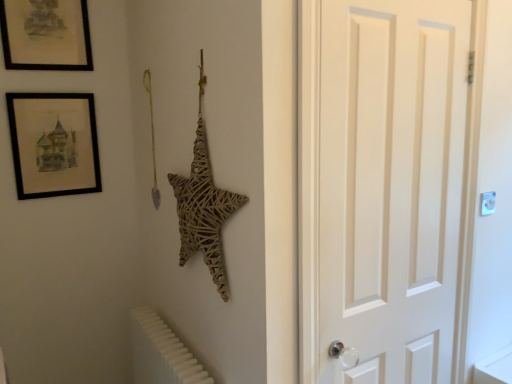
Describe the element at coordinates (488, 203) in the screenshot. I see `white plastic light switch at upper right` at that location.

The image size is (512, 384). I want to click on white plastic radiator at lower left, so click(161, 352).

What is the approximate width of black matte picture frame at upper left, positioned as the 1th picture frame in bottom-to-top order?

The width of black matte picture frame at upper left, positioned as the 1th picture frame in bottom-to-top order, is 2.23 inches.

Locate an element on the screen. white wooden door at right is located at coordinates (385, 187).

You are a GUI agent. You are given a task and a screenshot of the screen. Output one action in this format:
    pyautogui.click(x=<x>, y=<y>)
    Task: Click on the white plastic light switch at upper right
    
    Given the screenshot: What is the action you would take?
    pyautogui.click(x=488, y=203)

Image resolution: width=512 pixels, height=384 pixels. Identify the location of radiator that appears below the white wooden door at right (from a real-world perspective). (161, 352).

Can you confirm if white plastic radiator at lower left is thinner than white wooden door at right?

No, white plastic radiator at lower left is not thinner than white wooden door at right.

Looking at this image, considering the positions of objects white plastic radiator at lower left and white wooden door at right in the image provided, who is more to the right, white plastic radiator at lower left or white wooden door at right?

white wooden door at right.

From the picture: Is white plastic radiator at lower left facing away from white wooden door at right?

No, white plastic radiator at lower left's orientation is not away from white wooden door at right.

Do you think white plastic radiator at lower left is within black matte picture frame at upper left, positioned as the 1th picture frame in bottom-to-top order, or outside of it?

white plastic radiator at lower left is spatially situated outside black matte picture frame at upper left, positioned as the 1th picture frame in bottom-to-top order.

Relative to black matte picture frame at upper left, positioned as the 1th picture frame in bottom-to-top order, is white plastic radiator at lower left in front or behind?

In the image, white plastic radiator at lower left appears in front of black matte picture frame at upper left, positioned as the 1th picture frame in bottom-to-top order.

Consider the image. Can you confirm if white plastic radiator at lower left is taller than black matte picture frame at upper left, placed as the second picture frame when sorted from top to bottom?

In fact, white plastic radiator at lower left may be shorter than black matte picture frame at upper left, placed as the second picture frame when sorted from top to bottom.

Between white plastic radiator at lower left and black matte picture frame at upper left, placed as the second picture frame when sorted from top to bottom, which one has larger width?

white plastic radiator at lower left is wider.

Would you say white plastic light switch at upper right is part of white wooden door at right's contents?

No, white plastic light switch at upper right is not surrounded by white wooden door at right.

Is white wooden door at right wider than white plastic light switch at upper right?

Indeed, white wooden door at right has a greater width compared to white plastic light switch at upper right.

How many degrees apart are the facing directions of white wooden door at right and white plastic light switch at upper right?

white wooden door at right and white plastic light switch at upper right are facing 0.34 degrees away from each other.

Does white wooden door at right turn towards white plastic light switch at upper right?

No, white wooden door at right is not turned towards white plastic light switch at upper right.

Is black matte picture frame at upper left, the 2th picture frame from the bottom, in front of white plastic light switch at upper right?

No, it is behind white plastic light switch at upper right.

Would you say black matte picture frame at upper left, the 1th picture frame when ordered from top to bottom, is to the left or to the right of white plastic light switch at upper right in the picture?

black matte picture frame at upper left, the 1th picture frame when ordered from top to bottom, is positioned on white plastic light switch at upper right's left side.

How distant is black matte picture frame at upper left, the 1th picture frame when ordered from top to bottom, from white plastic light switch at upper right?

A distance of 6.45 feet exists between black matte picture frame at upper left, the 1th picture frame when ordered from top to bottom, and white plastic light switch at upper right.

Can you confirm if black matte picture frame at upper left, the 2th picture frame from the bottom, is smaller than white plastic light switch at upper right?

Actually, black matte picture frame at upper left, the 2th picture frame from the bottom, might be larger than white plastic light switch at upper right.

How distant is black matte picture frame at upper left, positioned as the 1th picture frame in bottom-to-top order, from white plastic light switch at upper right?

black matte picture frame at upper left, positioned as the 1th picture frame in bottom-to-top order, is 1.86 meters away from white plastic light switch at upper right.

From a real-world perspective, who is located higher, black matte picture frame at upper left, positioned as the 1th picture frame in bottom-to-top order, or white plastic light switch at upper right?

From a 3D spatial view, black matte picture frame at upper left, positioned as the 1th picture frame in bottom-to-top order, is above.

Which of these two, black matte picture frame at upper left, positioned as the 1th picture frame in bottom-to-top order, or white plastic light switch at upper right, is bigger?

black matte picture frame at upper left, positioned as the 1th picture frame in bottom-to-top order.

Is point (57, 174) farther from camera compared to point (482, 195)?

Yes, point (57, 174) is farther from viewer.

Based on the photo, is black matte picture frame at upper left, positioned as the 1th picture frame in bottom-to-top order, oriented away from white wooden door at right?

black matte picture frame at upper left, positioned as the 1th picture frame in bottom-to-top order, is not turned away from white wooden door at right.

Can you tell me how much black matte picture frame at upper left, positioned as the 1th picture frame in bottom-to-top order, and white wooden door at right differ in facing direction?

The angle between the facing direction of black matte picture frame at upper left, positioned as the 1th picture frame in bottom-to-top order, and the facing direction of white wooden door at right is 0.482 degrees.

You are a GUI agent. You are given a task and a screenshot of the screen. Output one action in this format:
    pyautogui.click(x=<x>, y=<y>)
    Task: Click on the 2nd picture frame behind the white wooden door at right
    This screenshot has height=384, width=512.
    Given the screenshot: What is the action you would take?
    pyautogui.click(x=54, y=144)

Considering the sizes of objects black matte picture frame at upper left, positioned as the 1th picture frame in bottom-to-top order, and white wooden door at right in the image provided, who is taller, black matte picture frame at upper left, positioned as the 1th picture frame in bottom-to-top order, or white wooden door at right?

white wooden door at right.

How many degrees apart are the facing directions of black matte picture frame at upper left, the 1th picture frame when ordered from top to bottom, and black matte picture frame at upper left, placed as the second picture frame when sorted from top to bottom?

0.000456 degrees.

Is black matte picture frame at upper left, positioned as the 1th picture frame in bottom-to-top order, completely or partially inside black matte picture frame at upper left, the 2th picture frame from the bottom?

No, black matte picture frame at upper left, positioned as the 1th picture frame in bottom-to-top order, is not surrounded by black matte picture frame at upper left, the 2th picture frame from the bottom.

From the image's perspective, is black matte picture frame at upper left, the 1th picture frame when ordered from top to bottom, located beneath black matte picture frame at upper left, positioned as the 1th picture frame in bottom-to-top order?

Incorrect, from the image's perspective, black matte picture frame at upper left, the 1th picture frame when ordered from top to bottom, is higher than black matte picture frame at upper left, positioned as the 1th picture frame in bottom-to-top order.

From a real-world perspective, is black matte picture frame at upper left, the 1th picture frame when ordered from top to bottom, beneath black matte picture frame at upper left, positioned as the 1th picture frame in bottom-to-top order?

No, from a real-world perspective, black matte picture frame at upper left, the 1th picture frame when ordered from top to bottom, is not beneath black matte picture frame at upper left, positioned as the 1th picture frame in bottom-to-top order.

Where is `door on the right of white plastic radiator at lower left`? The height and width of the screenshot is (384, 512). door on the right of white plastic radiator at lower left is located at coordinates (385, 187).

This screenshot has width=512, height=384. What are the coordinates of `the 2nd picture frame behind the white plastic radiator at lower left` in the screenshot? It's located at (54, 144).

Looking at the image, which one is located further to black matte picture frame at upper left, the 2th picture frame from the bottom, white plastic light switch at upper right or white wooden door at right?

white plastic light switch at upper right is further to black matte picture frame at upper left, the 2th picture frame from the bottom.

From the image, which object appears to be farther from white plastic light switch at upper right, black matte picture frame at upper left, positioned as the 1th picture frame in bottom-to-top order, or white wooden door at right?

black matte picture frame at upper left, positioned as the 1th picture frame in bottom-to-top order.

Estimate the real-world distances between objects in this image. Which object is further from black matte picture frame at upper left, the 1th picture frame when ordered from top to bottom, black matte picture frame at upper left, placed as the second picture frame when sorted from top to bottom, or white wooden door at right?

white wooden door at right is further to black matte picture frame at upper left, the 1th picture frame when ordered from top to bottom.

Based on their spatial positions, is white wooden door at right or black matte picture frame at upper left, the 2th picture frame from the bottom, further from white plastic light switch at upper right?

black matte picture frame at upper left, the 2th picture frame from the bottom, is positioned further to the anchor white plastic light switch at upper right.

Based on their spatial positions, is white plastic radiator at lower left or white wooden door at right closer to black matte picture frame at upper left, the 2th picture frame from the bottom?

white plastic radiator at lower left.

Based on their spatial positions, is white wooden door at right or black matte picture frame at upper left, placed as the second picture frame when sorted from top to bottom, closer to white plastic radiator at lower left?

Among the two, black matte picture frame at upper left, placed as the second picture frame when sorted from top to bottom, is located nearer to white plastic radiator at lower left.

When comparing their distances from black matte picture frame at upper left, the 1th picture frame when ordered from top to bottom, does white plastic radiator at lower left or white plastic light switch at upper right seem further?

The object further to black matte picture frame at upper left, the 1th picture frame when ordered from top to bottom, is white plastic light switch at upper right.

From the image, which object appears to be farther from white wooden door at right, black matte picture frame at upper left, positioned as the 1th picture frame in bottom-to-top order, or black matte picture frame at upper left, the 1th picture frame when ordered from top to bottom?

Among the two, black matte picture frame at upper left, the 1th picture frame when ordered from top to bottom, is located further to white wooden door at right.

Identify the location of door between black matte picture frame at upper left, the 2th picture frame from the bottom, and white plastic light switch at upper right, in the horizontal direction. (385, 187).

You are a GUI agent. You are given a task and a screenshot of the screen. Output one action in this format:
    pyautogui.click(x=<x>, y=<y>)
    Task: Click on the picture frame between black matte picture frame at upper left, the 2th picture frame from the bottom, and white wooden door at right, in the horizontal direction
    Image resolution: width=512 pixels, height=384 pixels.
    Given the screenshot: What is the action you would take?
    pyautogui.click(x=54, y=144)

Locate an element on the screen. radiator between black matte picture frame at upper left, positioned as the 1th picture frame in bottom-to-top order, and white plastic light switch at upper right is located at coordinates (161, 352).

Find the location of a particular element. The width and height of the screenshot is (512, 384). door between white plastic radiator at lower left and white plastic light switch at upper right is located at coordinates (385, 187).